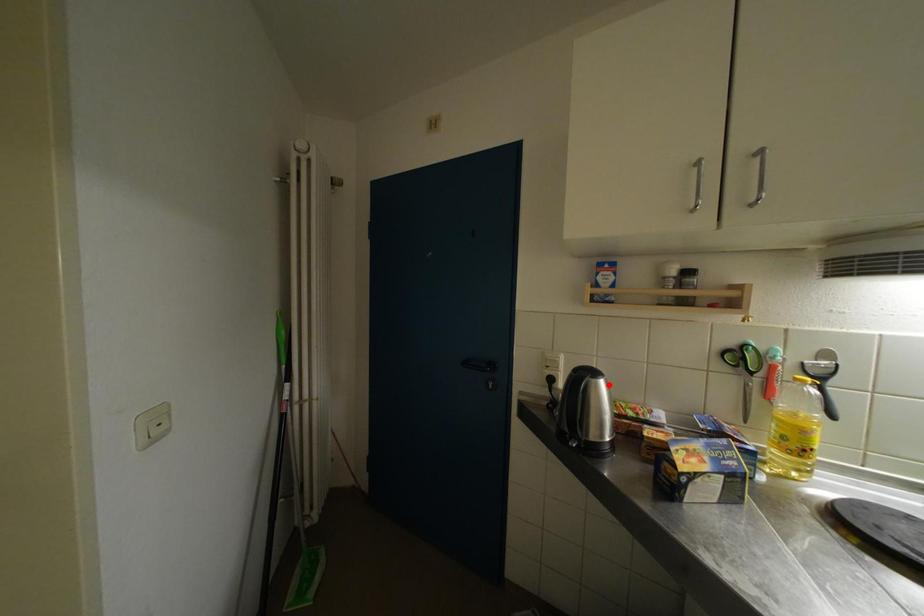
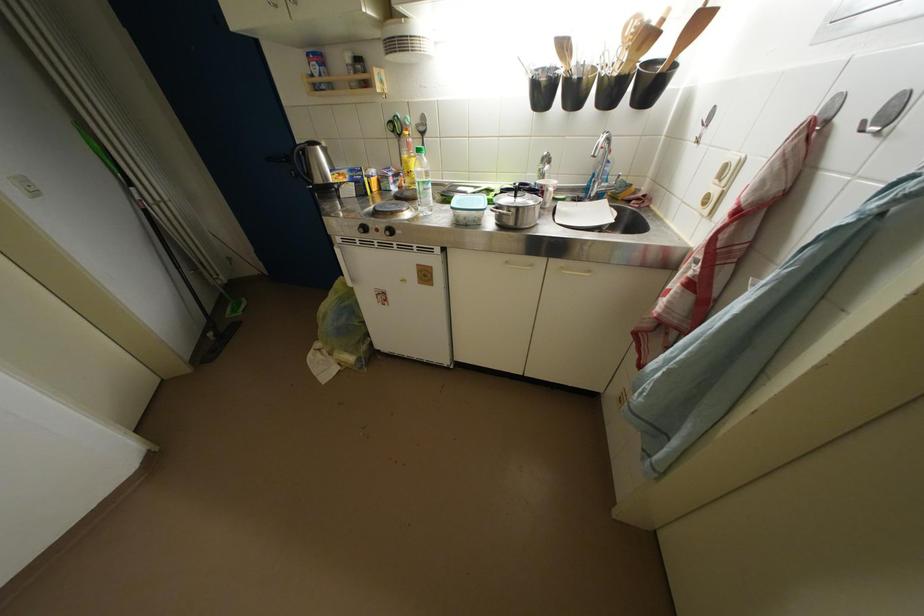
Where in the second image is the point corresponding to the highlighted location from the first image?

(324, 152)